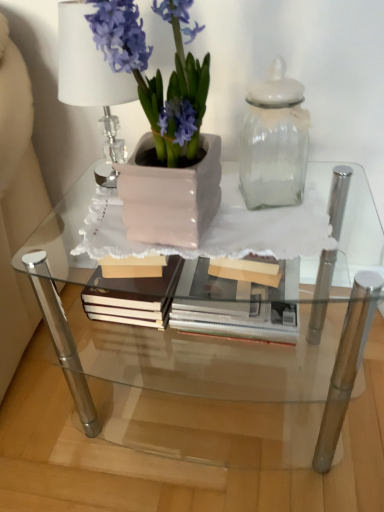
Question: Is matte pink pot at left located within clear glass table at center?

Choices:
 (A) yes
 (B) no

Answer: (B)

Question: Is clear glass table at center behind matte pink pot at left?

Choices:
 (A) no
 (B) yes

Answer: (B)

Question: Can you confirm if clear glass table at center is thinner than matte pink pot at left?

Choices:
 (A) no
 (B) yes

Answer: (A)

Question: Considering the relative sizes of clear glass table at center and matte pink pot at left in the image provided, is clear glass table at center wider than matte pink pot at left?

Choices:
 (A) no
 (B) yes

Answer: (B)

Question: Is clear glass table at center bigger than matte pink pot at left?

Choices:
 (A) yes
 (B) no

Answer: (A)

Question: From a real-world perspective, is clear glass table at center located higher than matte pink pot at left?

Choices:
 (A) yes
 (B) no

Answer: (B)

Question: From the image's perspective, is clear glass table at center below transparent glass jar at upper right?

Choices:
 (A) yes
 (B) no

Answer: (A)

Question: Does clear glass table at center appear on the left side of transparent glass jar at upper right?

Choices:
 (A) yes
 (B) no

Answer: (A)

Question: Does clear glass table at center have a lesser height compared to transparent glass jar at upper right?

Choices:
 (A) yes
 (B) no

Answer: (B)

Question: From a real-world perspective, is clear glass table at center over transparent glass jar at upper right?

Choices:
 (A) yes
 (B) no

Answer: (B)

Question: Is clear glass table at center at the right side of transparent glass jar at upper right?

Choices:
 (A) no
 (B) yes

Answer: (A)

Question: Is clear glass table at center positioned far away from transparent glass jar at upper right?

Choices:
 (A) no
 (B) yes

Answer: (A)

Question: Is matte pink pot at left smaller than clear glass table at center?

Choices:
 (A) yes
 (B) no

Answer: (A)